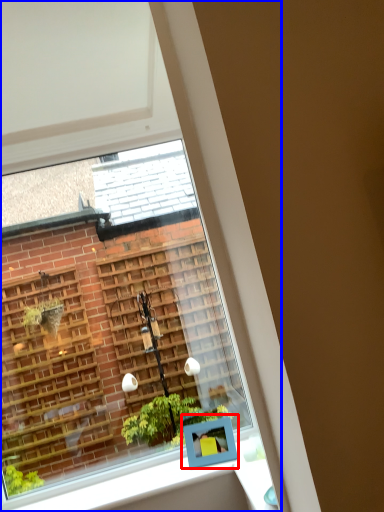
Question: Among these objects, which one is farthest to the camera, window box (highlighted by a red box) or window (highlighted by a blue box)?

Choices:
 (A) window box
 (B) window

Answer: (B)